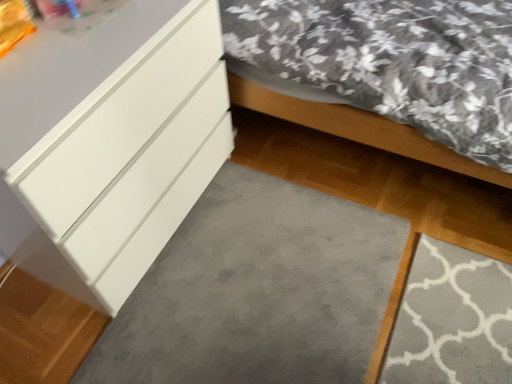
Question: Based on their positions, is gray soft carpet at lower center located to the left or right of matte white bed at lower left?

Choices:
 (A) right
 (B) left

Answer: (B)

Question: Looking at their shapes, would you say gray soft carpet at lower center is wider or thinner than matte white bed at lower left?

Choices:
 (A) wide
 (B) thin

Answer: (B)

Question: Which object is the closest to the matte white bed at lower left?

Choices:
 (A) gray soft carpet at lower center
 (B) white glossy chest of drawers at left

Answer: (B)

Question: Which object is the closest to the white glossy chest of drawers at left?

Choices:
 (A) gray soft carpet at lower center
 (B) matte white bed at lower left

Answer: (A)